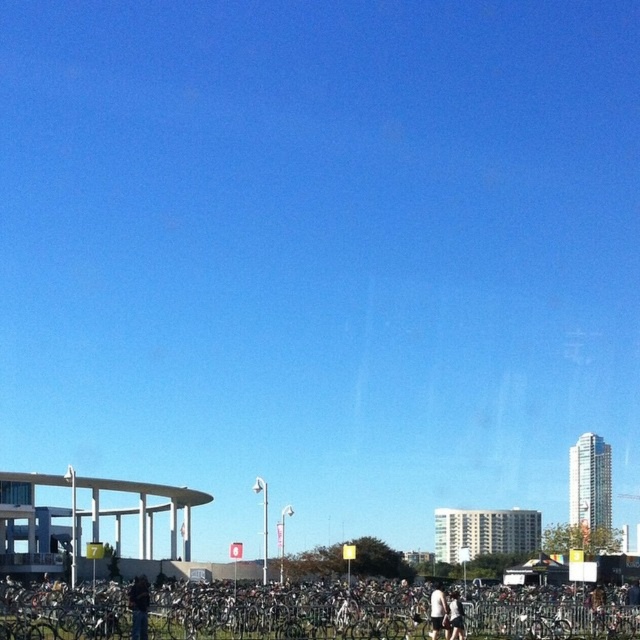
Is silver metallic bicycle at center below dark brown leather jacket at lower center?

No.

Does silver metallic bicycle at center have a greater height compared to dark brown leather jacket at lower center?

No.

Between point (3, 593) and point (131, 630), which one is positioned in front?

Point (131, 630)

You are a GUI agent. You are given a task and a screenshot of the screen. Output one action in this format:
    pyautogui.click(x=<x>, y=<y>)
    Task: Click on the silver metallic bicycle at center
    
    Given the screenshot: What is the action you would take?
    pyautogui.click(x=285, y=612)

Is point (138, 602) closer to camera compared to point (442, 627)?

Yes, point (138, 602) is in front of point (442, 627).

Who is taller, dark brown leather jacket at lower center or white matte shirt at lower center?

Standing taller between the two is dark brown leather jacket at lower center.

Between point (138, 580) and point (442, 620), which one is positioned behind?

The point (138, 580) is more distant.

Find the location of a particular element. dark brown leather jacket at lower center is located at coordinates (138, 605).

In the scene shown: Is dark brown leather jacket at lower center positioned at the back of white cotton shorts at lower center?

No, it is not.

Which of these two, dark brown leather jacket at lower center or white cotton shorts at lower center, stands taller?

Standing taller between the two is dark brown leather jacket at lower center.

Is point (145, 595) positioned in front of point (458, 608)?

No.

The height and width of the screenshot is (640, 640). I want to click on dark brown leather jacket at lower center, so click(x=138, y=605).